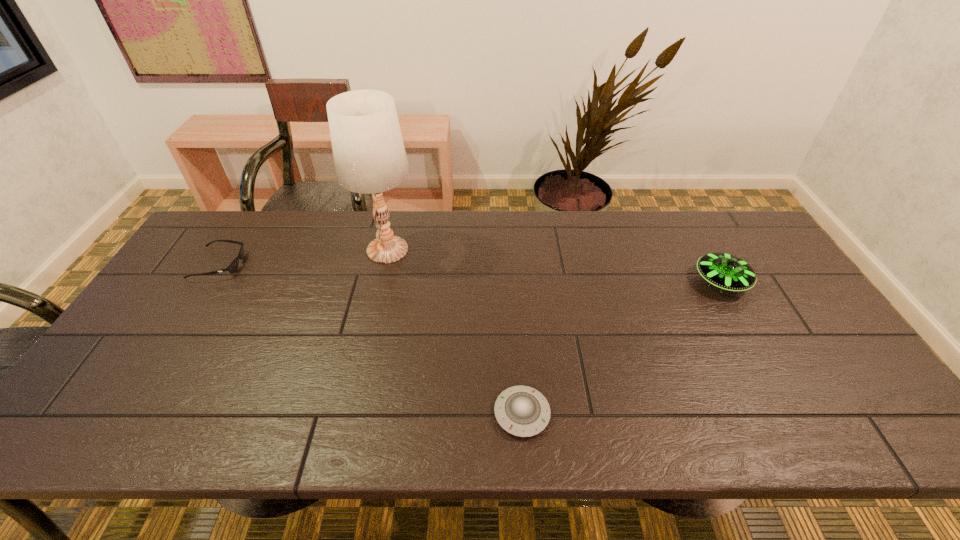
Locate an element on the screen. empty location between the tallest object and the leftmost object is located at coordinates (303, 257).

You are a GUI agent. You are given a task and a screenshot of the screen. Output one action in this format:
    pyautogui.click(x=<x>, y=<y>)
    Task: Click on the empty location between the third tallest object and the farther saucer
    The image size is (960, 540).
    Given the screenshot: What is the action you would take?
    pyautogui.click(x=470, y=273)

Where is `empty location between the farther saucer and the third object from left to right`? This screenshot has height=540, width=960. empty location between the farther saucer and the third object from left to right is located at coordinates (621, 347).

Select which object appears as the third closest to the sunglasses. Please provide its 2D coordinates. Your answer should be formatted as a tuple, i.e. [(x, y)], where the tuple contains the x and y coordinates of a point satisfying the conditions above.

[(728, 272)]

In order to click on object that is the closest to the tallest object in this screenshot , I will do `click(233, 266)`.

Where is `free space that satisfies the following two spatial constraints: 1. on the front-facing side of the third tallest object; 2. on the back side of the second tallest object`? This screenshot has width=960, height=540. free space that satisfies the following two spatial constraints: 1. on the front-facing side of the third tallest object; 2. on the back side of the second tallest object is located at coordinates (209, 281).

Identify the location of free spot that satisfies the following two spatial constraints: 1. on the front-facing side of the right saucer; 2. on the left side of the leftmost object. This screenshot has height=540, width=960. (209, 281).

The width and height of the screenshot is (960, 540). I want to click on vacant region that satisfies the following two spatial constraints: 1. on the back side of the shorter saucer; 2. on the front-facing side of the sunglasses, so click(511, 265).